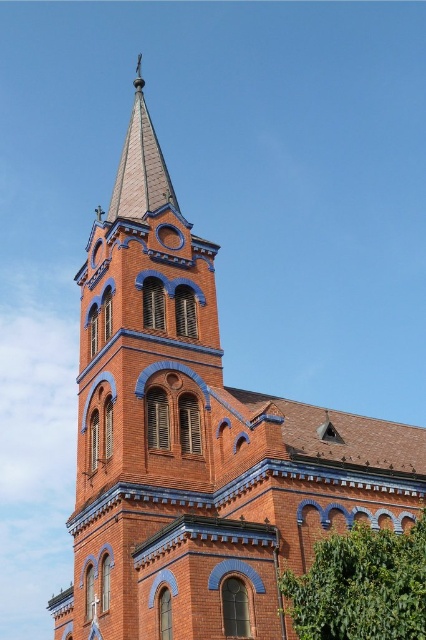
You are an architect evaluating the spatial layout of the church. You need to determine if the green leafy tree at lower right can be moved closer to the shiny blue tile spire at upper center without blocking its view from the main entrance. Based on their sizes, is this feasible?

The green leafy tree at lower right has a smaller width than the shiny blue tile spire at upper center. Since the tree is narrower, it can be moved closer to the spire without obstructing the view of the spire from the main entrance.

You are standing in front of the church tower. There are two points marked on the tower. The first point is at coordinates point (x=347, y=538) and the second point is at point (x=120, y=168). Which point is closer to you?

Point (x=347, y=538) is closer to the viewer than point (x=120, y=168).

From the picture: You are standing in a park adjacent to the church. You see the green leafy tree at lower right and the shiny blue tile spire at upper center. Which object appears closer to you based on their positions in the image?

The green leafy tree at lower right appears closer because it is positioned in front of the shiny blue tile spire at upper center.